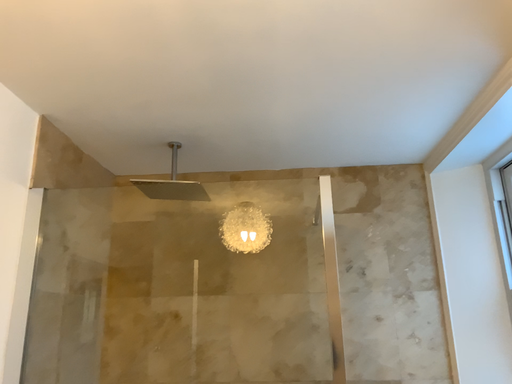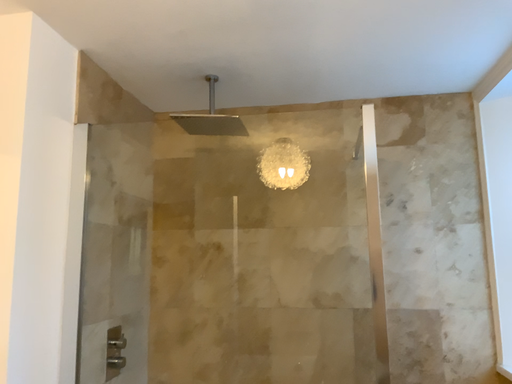
Question: Which way did the camera rotate in the video?

Choices:
 (A) rotated downward
 (B) rotated upward

Answer: (A)